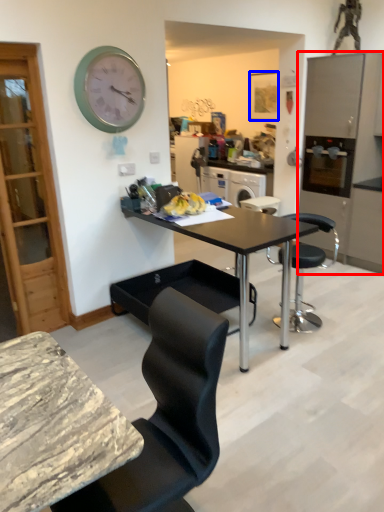
Question: Among these objects, which one is nearest to the camera, cabinetry (highlighted by a red box) or picture frame (highlighted by a blue box)?

Choices:
 (A) cabinetry
 (B) picture frame

Answer: (A)